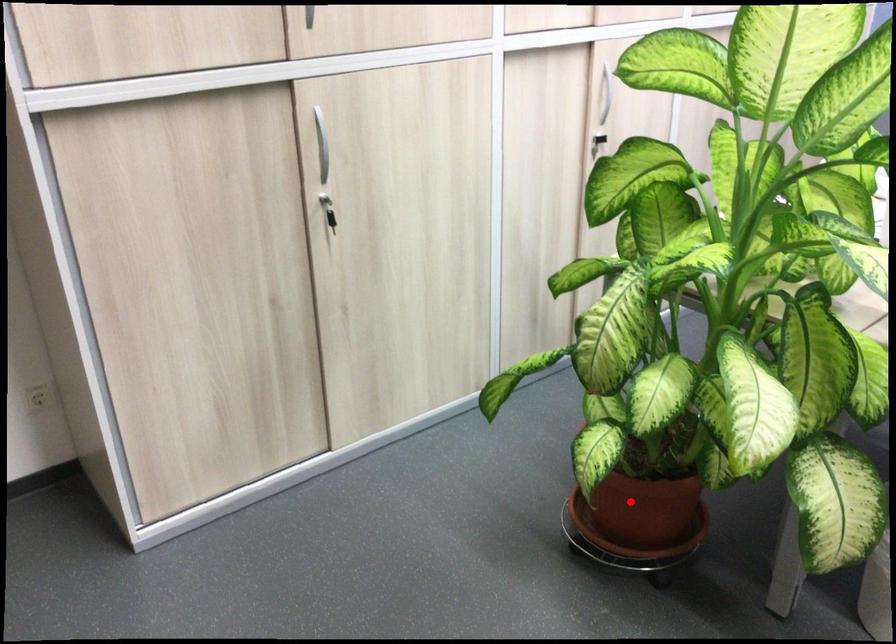
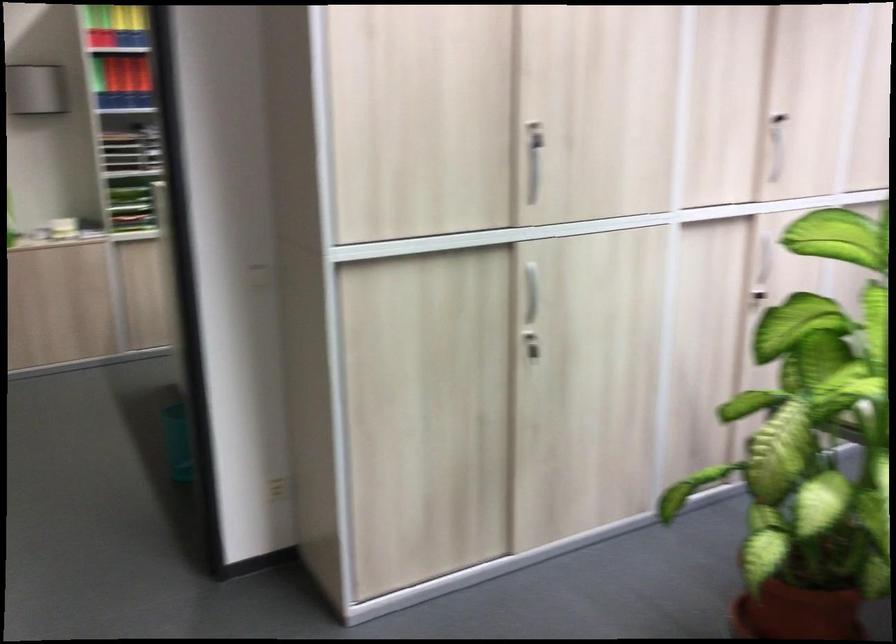
Question: I am providing you with two images of the same scene from different viewpoints. Given a red point in image1, look at the same physical point in image2. Is it:

Choices:
 (A) Closer to the viewpoint
 (B) Farther from the viewpoint

Answer: (B)